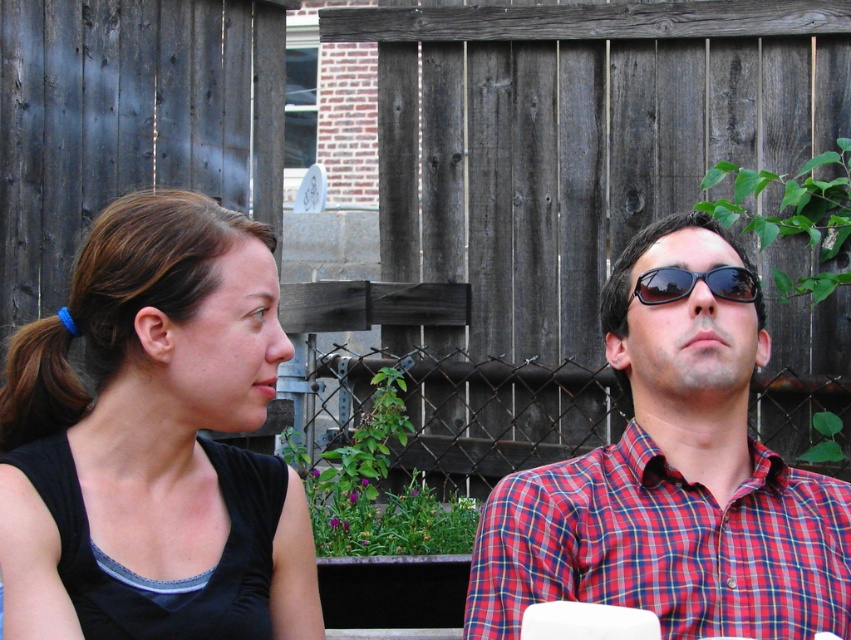
Question: Which is nearer to the black fabric at left?

Choices:
 (A) black reflective sunglasses at upper center
 (B) black matte shirt at center

Answer: (B)

Question: Can you confirm if plaid shirt at center is positioned to the right of black reflective sunglasses at upper center?

Choices:
 (A) yes
 (B) no

Answer: (B)

Question: Among these points, which one is farthest from the camera?

Choices:
 (A) (615, 502)
 (B) (665, 268)
 (C) (204, 499)
 (D) (183, 566)

Answer: (B)

Question: Is black matte shirt at center to the right of black reflective sunglasses at upper center from the viewer's perspective?

Choices:
 (A) yes
 (B) no

Answer: (B)

Question: From the image, what is the correct spatial relationship of black fabric at left in relation to black reflective sunglasses at upper center?

Choices:
 (A) left
 (B) right

Answer: (A)

Question: Which object is closer to the camera taking this photo?

Choices:
 (A) black reflective sunglasses at upper center
 (B) black fabric at left
 (C) black matte shirt at center
 (D) plaid shirt at center

Answer: (B)